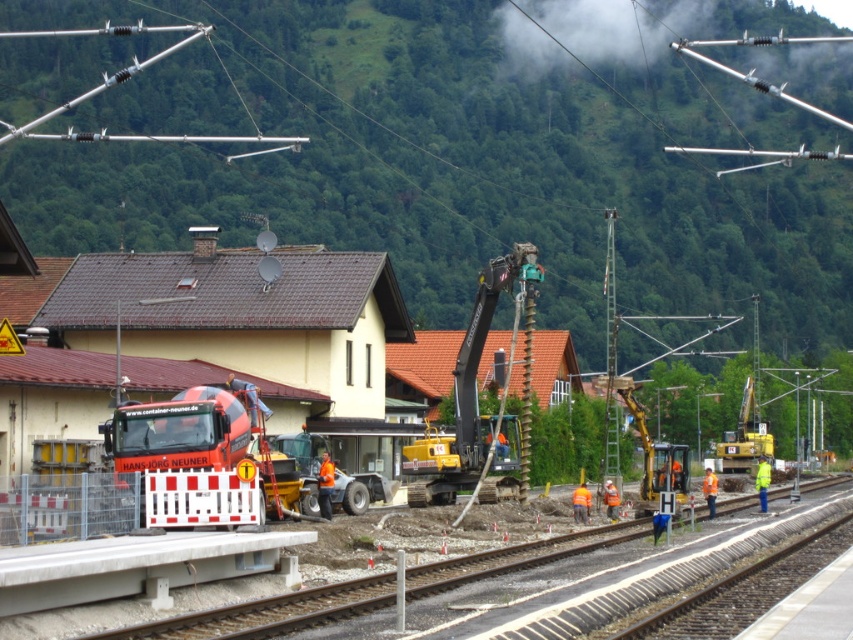
Does metallic yellow excavator at center have a smaller size compared to yellow metallic excavator at center-right?

Incorrect, metallic yellow excavator at center is not smaller in size than yellow metallic excavator at center-right.

This screenshot has height=640, width=853. What are the coordinates of `metallic yellow excavator at center` in the screenshot? It's located at (653, 451).

Consider the image. Which is more to the left, teal metallic excavator at center or metallic yellow excavator at center?

From the viewer's perspective, teal metallic excavator at center appears more on the left side.

Is point (503, 285) positioned in front of point (643, 500)?

Yes, point (503, 285) is in front of point (643, 500).

Is point (515, 468) positioned after point (650, 472)?

That is False.

Find the location of a particular element. teal metallic excavator at center is located at coordinates (479, 406).

Based on the photo, who is positioned more to the left, teal metallic excavator at center or yellow metallic excavator at center-right?

teal metallic excavator at center

Is teal metallic excavator at center bigger than yellow metallic excavator at center-right?

Correct, teal metallic excavator at center is larger in size than yellow metallic excavator at center-right.

This screenshot has width=853, height=640. I want to click on teal metallic excavator at center, so click(x=479, y=406).